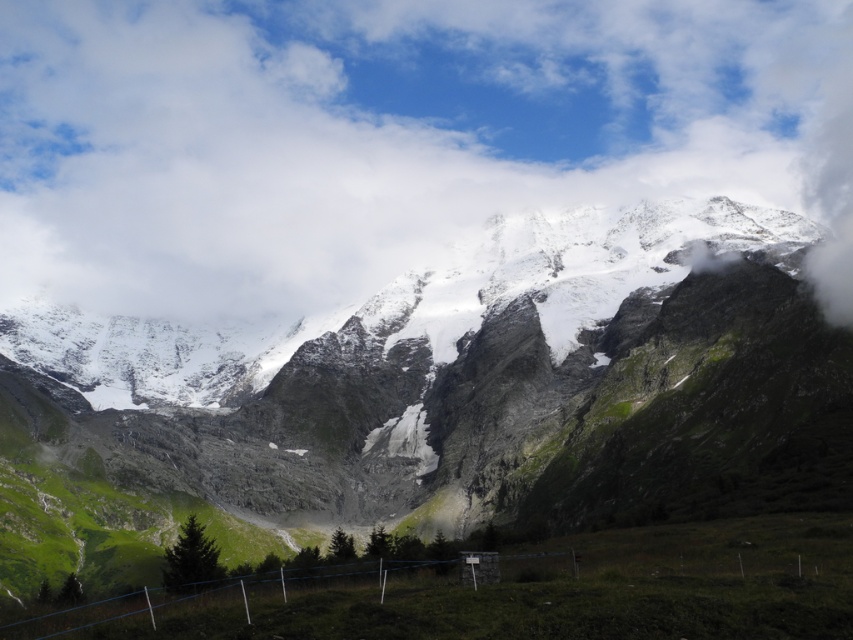
You are a drone pilot trying to capture the white fluffy cloud at upper center. Your drone can only fly up to 0.5 units high. Can your drone reach the cloud based on its position?

The white fluffy cloud at upper center is located at point (387,136), so yes, the drone can reach it since its height is within the 0.5 units limit.

You are a drone operator planning to fly a drone between the white fluffy cloud at upper center and the snowy granite mountain range at upper center. The drone has a maximum flight range of 150 feet. Can the drone safely reach the other side without exceeding its range?

The distance between the white fluffy cloud at upper center and the snowy granite mountain range at upper center is 154.36 feet, which exceeds the drone operator maximum flight range of 150 feet. Therefore, the drone cannot safely reach the other side without exceeding its range.

You are standing at the camera position and want to reach point (291,81). If you walk straight ahead, will you reach that point before walking 1000 feet?

The distance between point (291,81) and the camera is 948.64 feet, so yes, you will reach point (291,81) before walking 1000 feet.